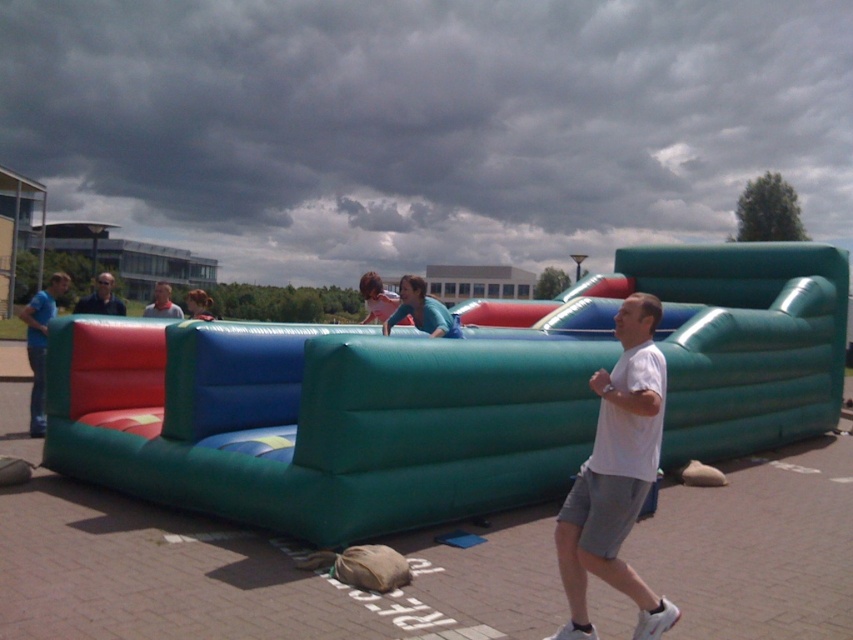
Question: Is matte black sunglasses at upper left to the right of matte white shirt at center from the viewer's perspective?

Choices:
 (A) yes
 (B) no

Answer: (B)

Question: Can you confirm if matte black sunglasses at upper left is thinner than matte white shirt at center?

Choices:
 (A) no
 (B) yes

Answer: (A)

Question: Considering the real-world distances, which object is farthest from the blue t-shirt at left?

Choices:
 (A) matte black sunglasses at upper left
 (B) white matte t-shirt at center
 (C) matte white shirt at center

Answer: (B)

Question: Which point is closer to the camera?

Choices:
 (A) matte black sunglasses at upper left
 (B) white matte t-shirt at center
 (C) blue t-shirt at left

Answer: (B)

Question: Is blue t-shirt at left to the left of matte white shirt at center from the viewer's perspective?

Choices:
 (A) yes
 (B) no

Answer: (A)

Question: Which of these objects is positioned farthest from the matte white shirt at center?

Choices:
 (A) white matte t-shirt at center
 (B) blue t-shirt at left
 (C) matte black sunglasses at upper left

Answer: (A)